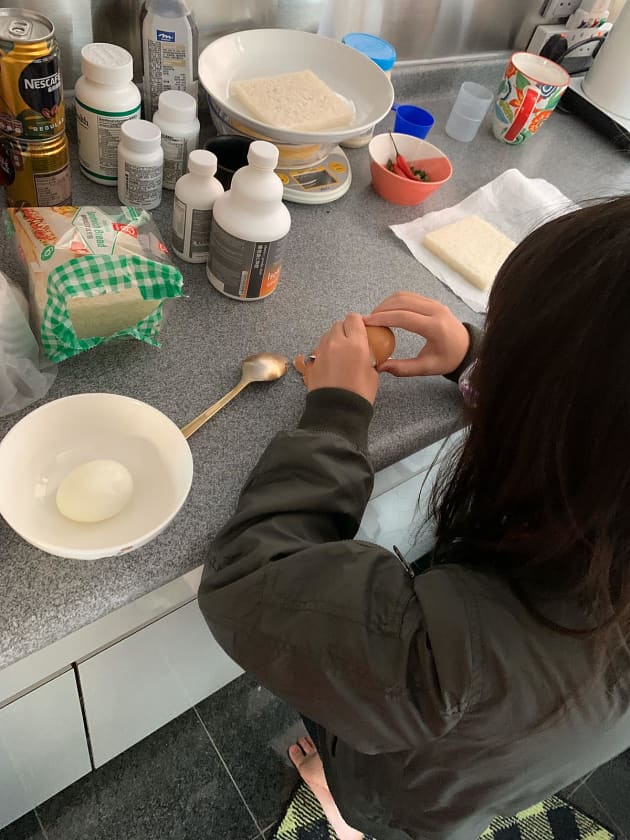
Where is `cupboards`? Image resolution: width=630 pixels, height=840 pixels. cupboards is located at coordinates (174, 685).